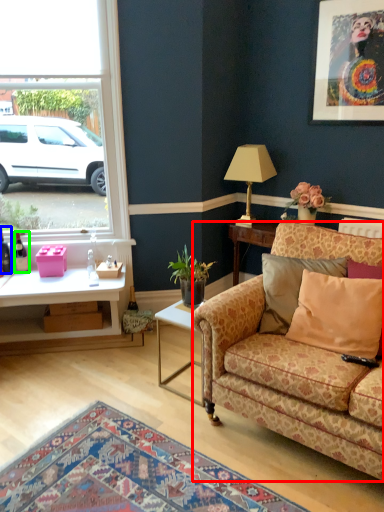
Question: Considering the real-world distances, which object is closest to studio couch (highlighted by a red box)? bottle (highlighted by a blue box) or bottle (highlighted by a green box).

Choices:
 (A) bottle
 (B) bottle

Answer: (B)